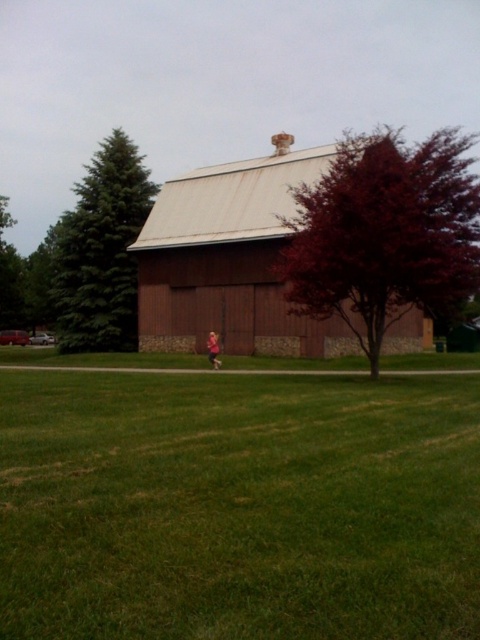
Does shiny crimson tree at right lie in front of brown wooden barn at center?

Yes.

Which is behind, point (372, 356) or point (264, 216)?

Positioned behind is point (264, 216).

Is point (288, 252) in front of point (300, 176)?

Yes, point (288, 252) is in front of point (300, 176).

Locate an element on the screen. shiny crimson tree at right is located at coordinates (384, 234).

Is brown wooden barn at center to the left of green fir tree at left from the viewer's perspective?

In fact, brown wooden barn at center is to the right of green fir tree at left.

Does point (194, 278) come in front of point (124, 170)?

Yes.

Image resolution: width=480 pixels, height=640 pixels. Describe the element at coordinates (228, 260) in the screenshot. I see `brown wooden barn at center` at that location.

Identify the location of brown wooden barn at center. (228, 260).

Which is more to the left, green grass at center or pink fabric at center?

Positioned to the left is pink fabric at center.

Is green grass at center further to the viewer compared to pink fabric at center?

That is False.

Does point (255, 435) come behind point (215, 333)?

No, (255, 435) is closer to viewer.

At what (x,y) coordinates should I click in order to perform the action: click on green grass at center. Please return your answer as a coordinate pair (x, y). This screenshot has width=480, height=640. Looking at the image, I should click on (236, 500).